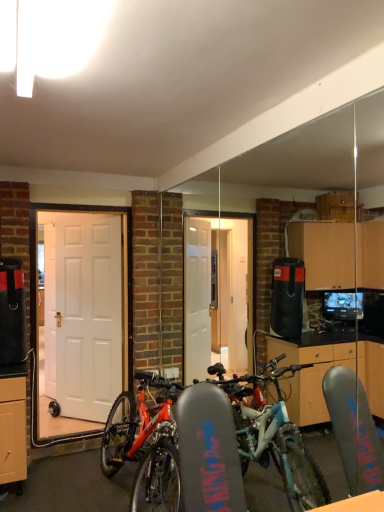
Question: Does point (66, 412) appear closer or farther from the camera than point (49, 343)?

Choices:
 (A) closer
 (B) farther

Answer: (A)

Question: Considering the positions of white glossy door at center, the 2th door viewed from the back, and white matte door at left, arranged as the 1th door when viewed from the back, in the image, is white glossy door at center, the 2th door viewed from the back, wider or thinner than white matte door at left, arranged as the 1th door when viewed from the back,?

Choices:
 (A) thin
 (B) wide

Answer: (B)

Question: From the image's perspective, is white glossy door at center, the 2th door viewed from the back, located above or below white matte door at left, the 1th door from the left?

Choices:
 (A) below
 (B) above

Answer: (B)

Question: Considering the positions of white matte door at left, the 1th door from the left, and white glossy door at center, the 2th door viewed from the back, in the image, is white matte door at left, the 1th door from the left, taller or shorter than white glossy door at center, the 2th door viewed from the back,?

Choices:
 (A) tall
 (B) short

Answer: (B)

Question: Is point (52, 354) closer or farther from the camera than point (51, 288)?

Choices:
 (A) closer
 (B) farther

Answer: (B)

Question: In the image, is white matte door at left, the 1th door from the left, positioned in front of or behind white glossy door at center, which ranks as the first door in right-to-left order?

Choices:
 (A) behind
 (B) front

Answer: (A)

Question: Looking at the image, does white matte door at left, marked as the 2th door in a front-to-back arrangement, seem bigger or smaller compared to white glossy door at center, the second door from the left?

Choices:
 (A) big
 (B) small

Answer: (B)